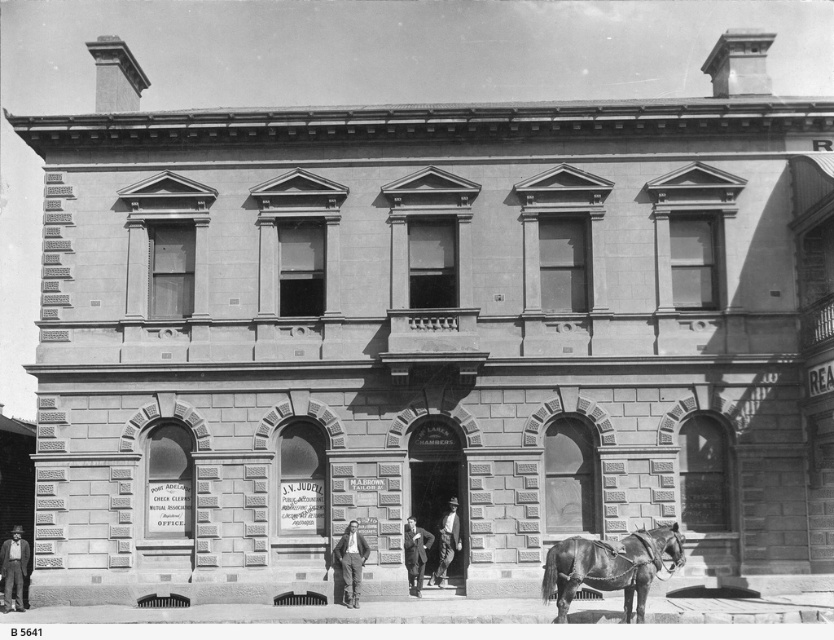
Looking at this image, you are standing in front of the two story building with three arched doorways labeled J.V. JUDEL, M. BROWN, and W. LAMBERT HAMBERS. You notice a dark brown leather hat at lower left. Where exactly is the dark brown leather hat located relative to the building?

The dark brown leather hat at lower left is located at the lower left corner of the building, near the base of the first arched doorway labeled J.V. JUDEL.